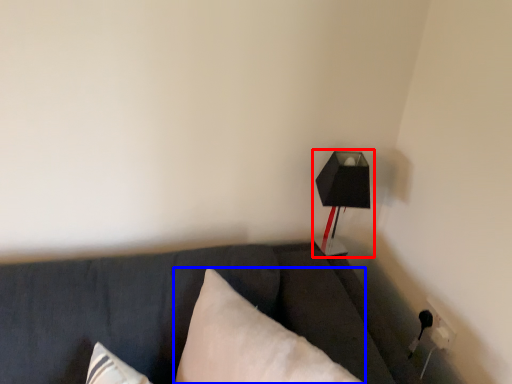
Question: Which object appears farthest to the camera in this image, lamp (highlighted by a red box) or pillow (highlighted by a blue box)?

Choices:
 (A) lamp
 (B) pillow

Answer: (A)